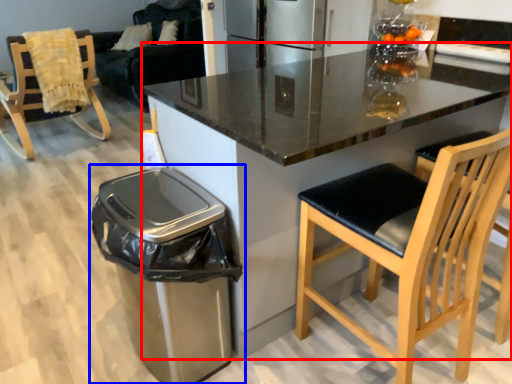
Question: Which point is further to the camera, countertop (highlighted by a red box) or waste container (highlighted by a blue box)?

Choices:
 (A) countertop
 (B) waste container

Answer: (B)